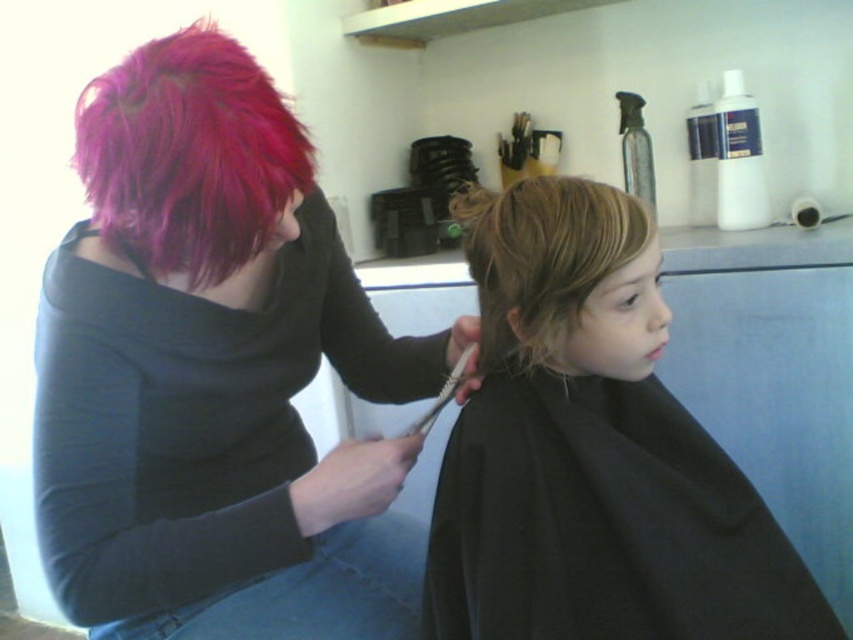
Question: Which point appears farthest from the camera in this image?

Choices:
 (A) pos(335,576)
 (B) pos(169,76)

Answer: (A)

Question: Which point is farther to the camera?

Choices:
 (A) blonde hair at center
 (B) light brown silky hair at center
 (C) matte plastic comb at center

Answer: (C)

Question: Can you confirm if shiny pink hair at upper left is positioned to the left of matte plastic comb at center?

Choices:
 (A) no
 (B) yes

Answer: (B)

Question: Which object is farther from the camera taking this photo?

Choices:
 (A) shiny pink hair at upper left
 (B) bright pink hair at upper left
 (C) matte plastic comb at center
 (D) light brown silky hair at center

Answer: (C)

Question: Does blonde hair at center lie behind matte plastic comb at center?

Choices:
 (A) no
 (B) yes

Answer: (A)

Question: Is shiny pink hair at upper left wider than blonde hair at center?

Choices:
 (A) yes
 (B) no

Answer: (A)